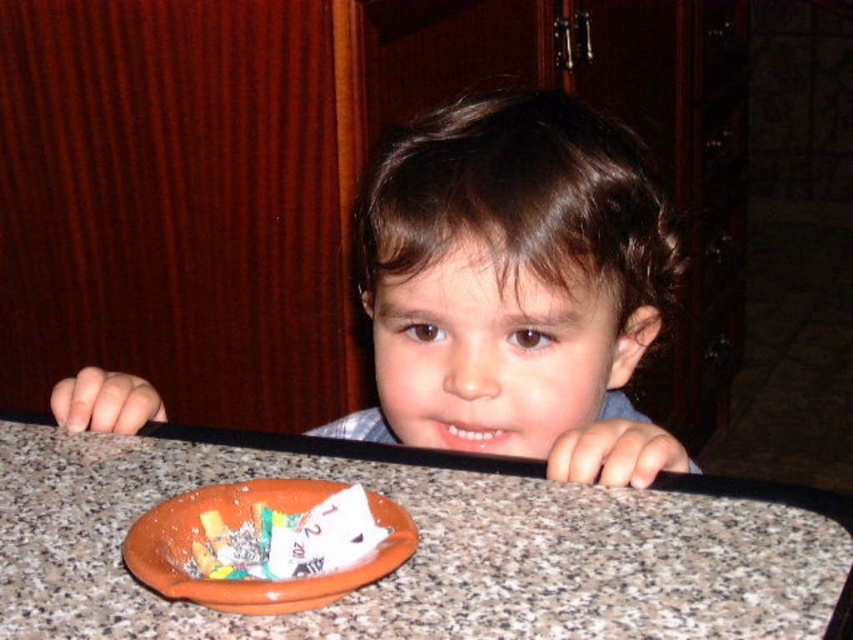
Looking at this image, you are a parent trying to locate your child who is hiding behind a countertop. You see the brown hair at center and the white paper candy at center. Which object is higher up from the floor?

The brown hair at center is much taller than the white paper candy at center, so the brown hair at center is higher up from the floor.

You are a delivery robot with a package that needs to be placed on the brown marble table at center. The robot has a height of 40 centimeters. Will the robot be able to place the package on the table without any obstruction?

The distance between the brown marble table at center and the camera is 38.70 centimeters. Since the robot is 40 centimeters tall, it will be slightly taller than the distance available, so it might not be able to place the package without bending or adjusting its height.